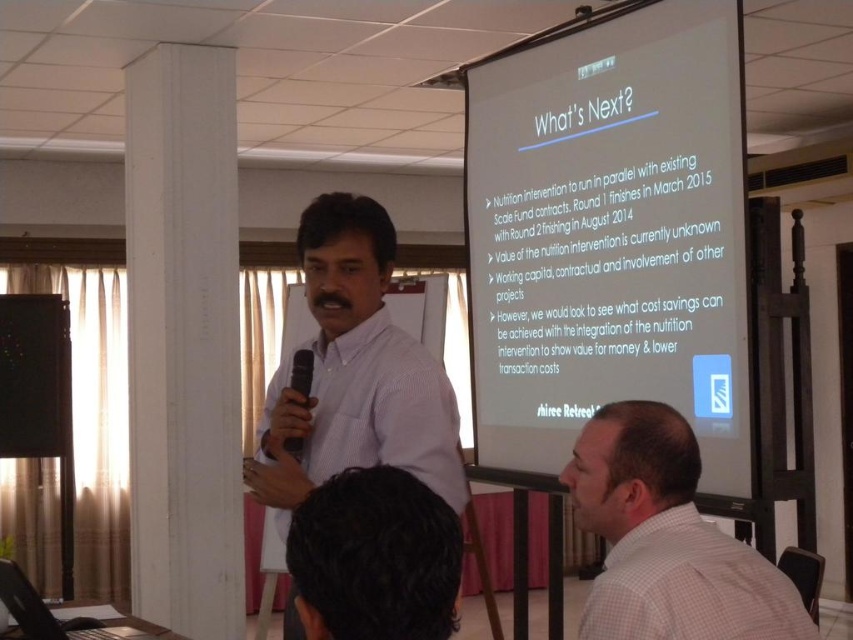
Consider the image. Is white checkered shirt at lower right closer to the viewer compared to black plastic microphone at center?

Yes, it is.

Is white checkered shirt at lower right shorter than black plastic microphone at center?

In fact, white checkered shirt at lower right may be taller than black plastic microphone at center.

Where is `white checkered shirt at lower right`? white checkered shirt at lower right is located at coordinates (666, 540).

Is point (408, 529) farther from viewer compared to point (294, 369)?

No.

Can you confirm if dark brown hair at upper center is positioned to the left of black plastic microphone at center?

No, dark brown hair at upper center is not to the left of black plastic microphone at center.

Identify the location of dark brown hair at upper center. (374, 557).

Does point (637, 566) lie in front of point (405, 572)?

That is False.

Is white checkered shirt at lower right bigger than dark brown hair at upper center?

Yes.

Is point (738, 582) in front of point (328, 529)?

That is False.

Image resolution: width=853 pixels, height=640 pixels. I want to click on white checkered shirt at lower right, so click(666, 540).